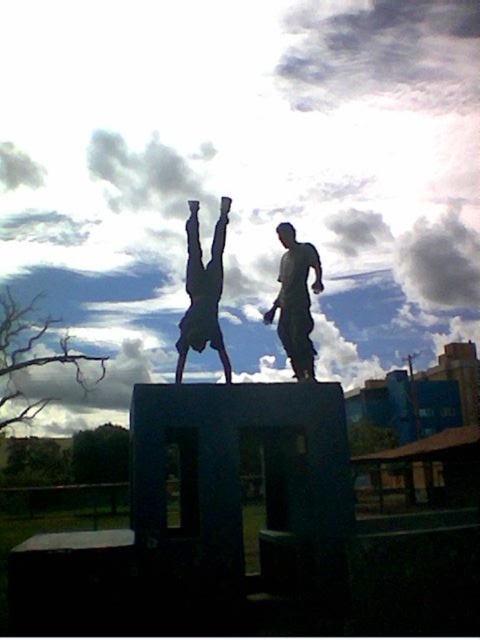
Question: Can you confirm if metallic silver statue at center is smaller than matte gray statue at center?

Choices:
 (A) no
 (B) yes

Answer: (B)

Question: Which point is farther to the camera?

Choices:
 (A) metallic silver statue at center
 (B) matte gray statue at center

Answer: (B)

Question: Which object appears farthest from the camera in this image?

Choices:
 (A) matte gray statue at center
 (B) metallic silver statue at center

Answer: (A)

Question: Is metallic silver statue at center thinner than matte gray statue at center?

Choices:
 (A) no
 (B) yes

Answer: (B)

Question: Which object appears farthest from the camera in this image?

Choices:
 (A) metallic silver statue at center
 (B) matte gray statue at center

Answer: (B)

Question: Is metallic silver statue at center bigger than matte gray statue at center?

Choices:
 (A) yes
 (B) no

Answer: (B)